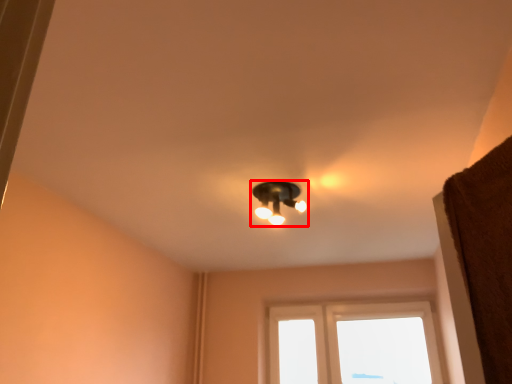
Question: From the image's perspective, what is the correct spatial relationship of lamp (annotated by the red box) in relation to window?

Choices:
 (A) below
 (B) above

Answer: (B)